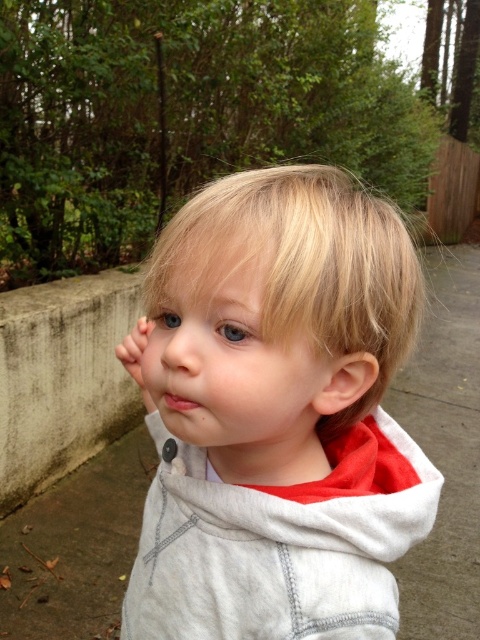
Between point (375, 378) and point (178, 371), which one is positioned in front?

Point (178, 371)

Is white cotton hoodie at center to the right of smooth skin nose at center from the viewer's perspective?

Yes, white cotton hoodie at center is to the right of smooth skin nose at center.

Does point (376, 557) come closer to viewer compared to point (180, 349)?

No, it is behind (180, 349).

Find the location of a particular element. white cotton hoodie at center is located at coordinates tap(279, 416).

Can you confirm if smooth skin nose at center is wider than pink matte lips at center?

Indeed, smooth skin nose at center has a greater width compared to pink matte lips at center.

Is smooth skin nose at center to the right of pink matte lips at center from the viewer's perspective?

No, smooth skin nose at center is not to the right of pink matte lips at center.

Which is in front, point (156, 323) or point (166, 394)?

Point (166, 394)

Find the location of `smooth skin nose at center`. smooth skin nose at center is located at coordinates (179, 344).

Between white cotton hoodie at center and pink matte lips at center, which one is positioned higher?

pink matte lips at center

Is white cotton hoodie at center to the right of pink matte lips at center from the viewer's perspective?

Correct, you'll find white cotton hoodie at center to the right of pink matte lips at center.

In order to click on white cotton hoodie at center in this screenshot , I will do `click(279, 416)`.

You are a GUI agent. You are given a task and a screenshot of the screen. Output one action in this format:
    pyautogui.click(x=<x>, y=<y>)
    Task: Click on the white cotton hoodie at center
    The image size is (480, 640).
    Given the screenshot: What is the action you would take?
    pyautogui.click(x=279, y=416)